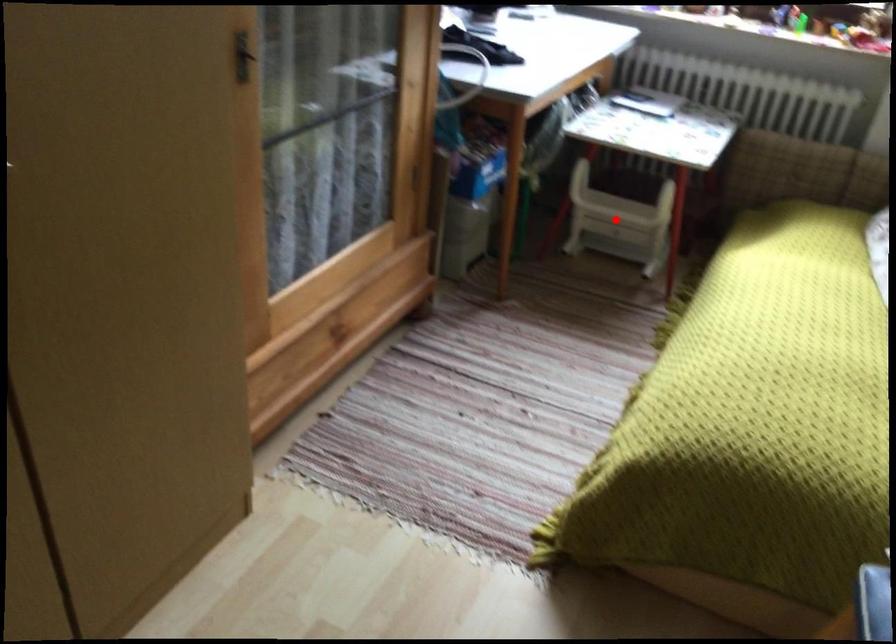
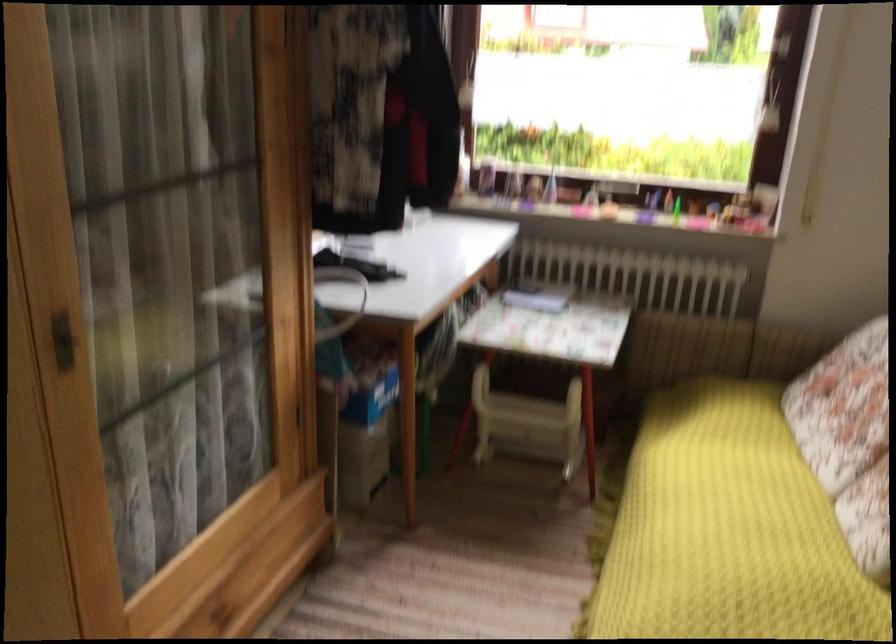
Where in the second image is the point corresponding to the highlighted location from the first image?

(528, 424)